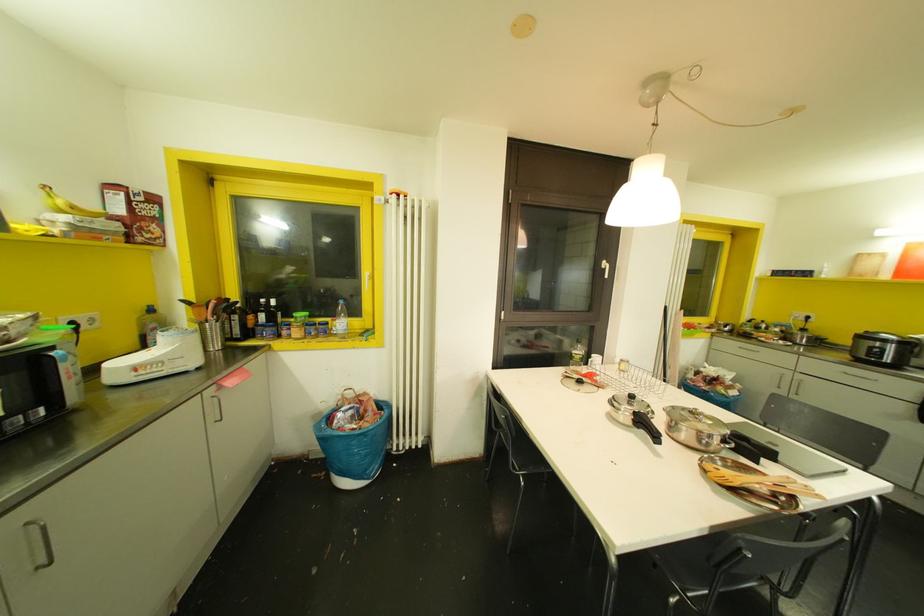
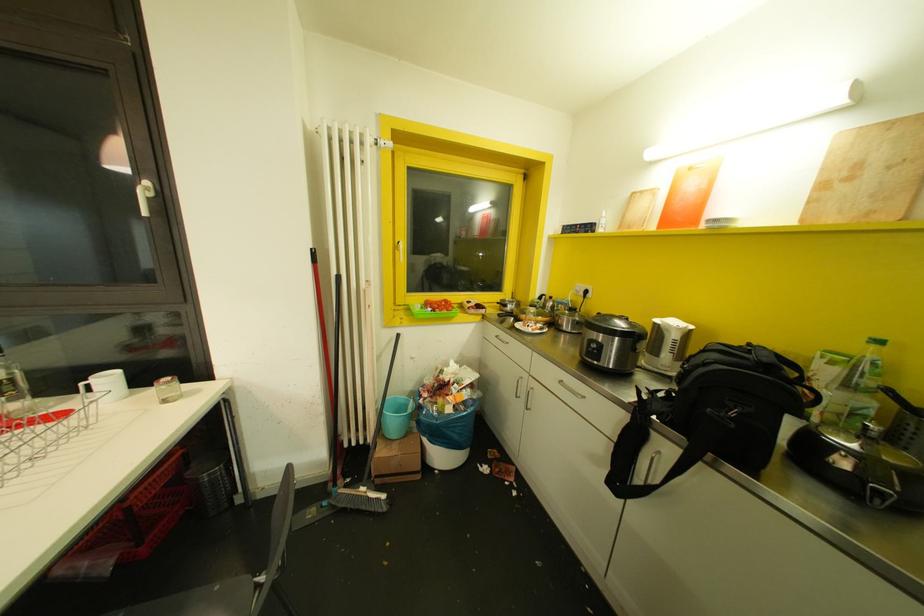
The images are taken continuously from a first-person perspective. In which direction are you moving?

The cameraman walked toward right, forward.